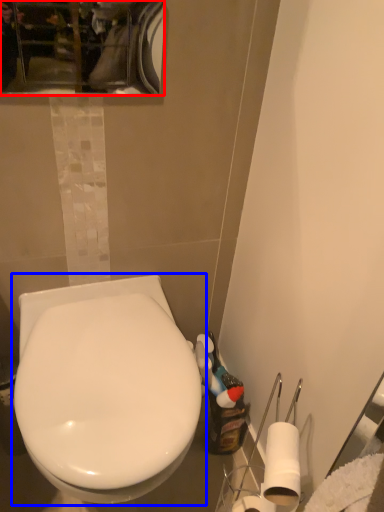
Question: Which of the following is the closest to the observer, mirror (highlighted by a red box) or toilet (highlighted by a blue box)?

Choices:
 (A) mirror
 (B) toilet

Answer: (B)